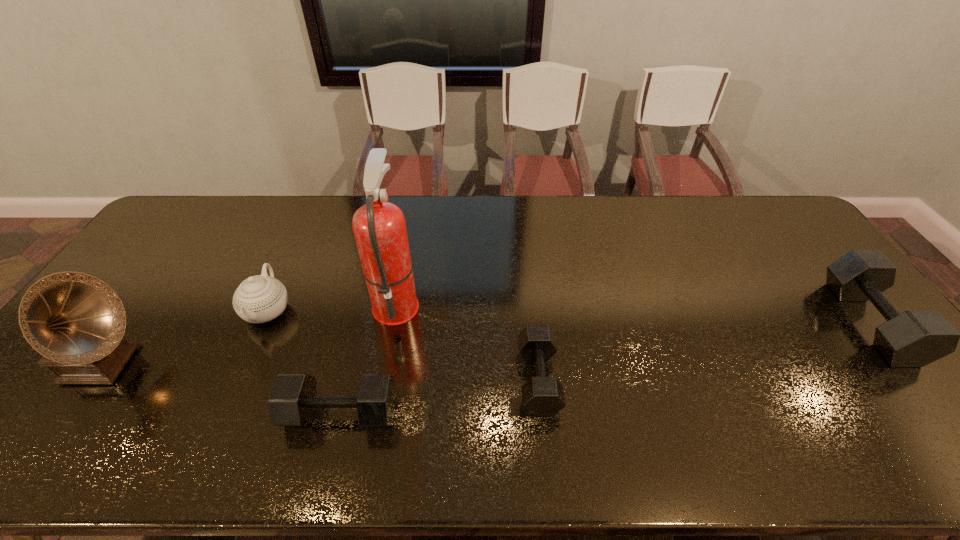
Locate an element on the screen. vacant area in the image that satisfies the following two spatial constraints: 1. on the horn of the fifth shortest object; 2. on the back side of the fifth tallest object is located at coordinates (67, 413).

In order to click on vacant region that satisfies the following two spatial constraints: 1. with the handle and hose on the fire extinguisher; 2. on the right side of the tallest dumbbell in this screenshot , I will do `click(393, 322)`.